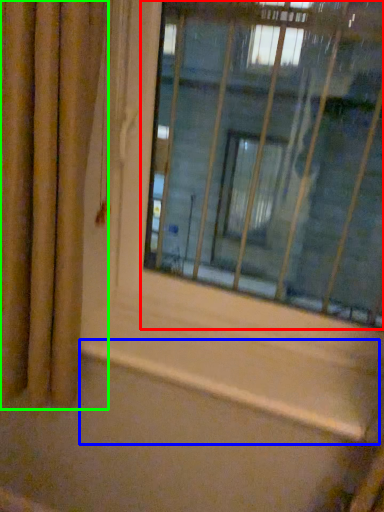
Question: Considering the real-world distances, which object is farthest from window (highlighted by a red box)? window sill (highlighted by a blue box) or curtain (highlighted by a green box)?

Choices:
 (A) window sill
 (B) curtain

Answer: (A)